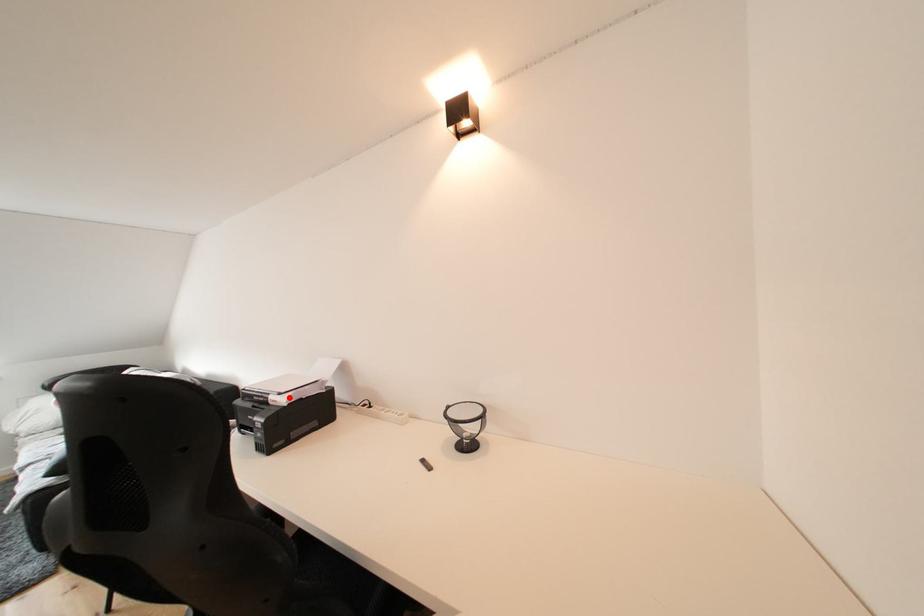
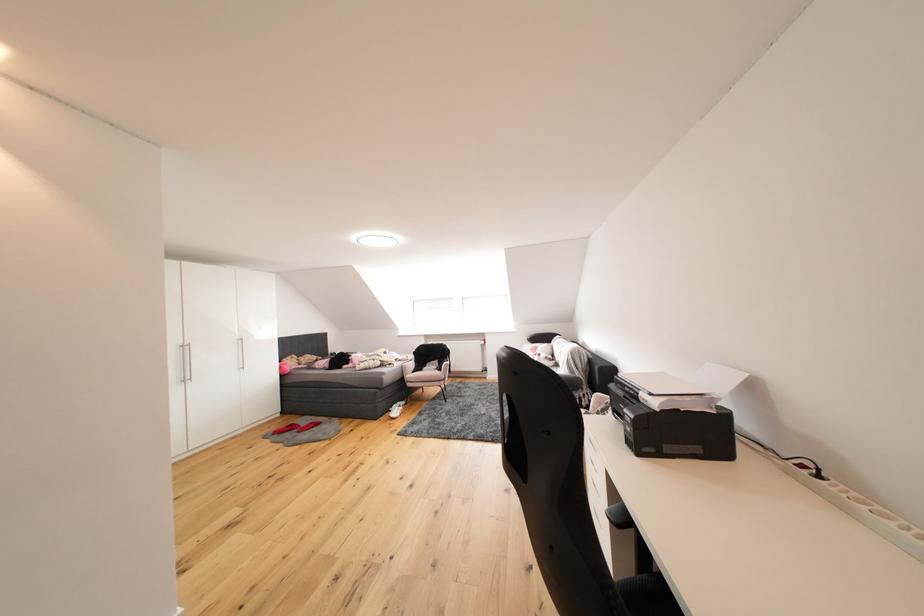
In the second image, find the point that corresponds to the highlighted location in the first image.

(661, 398)